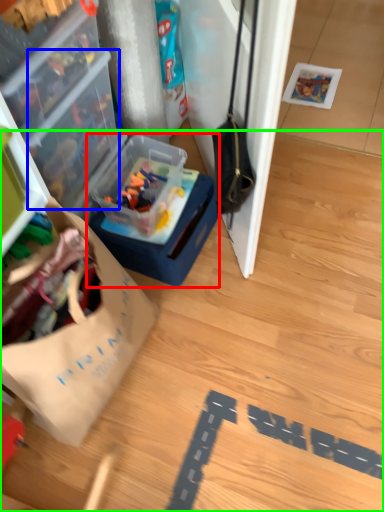
Question: Considering the real-world distances, which object is closest to box (highlighted by a red box)? box (highlighted by a blue box) or wood (highlighted by a green box).

Choices:
 (A) box
 (B) wood

Answer: (A)